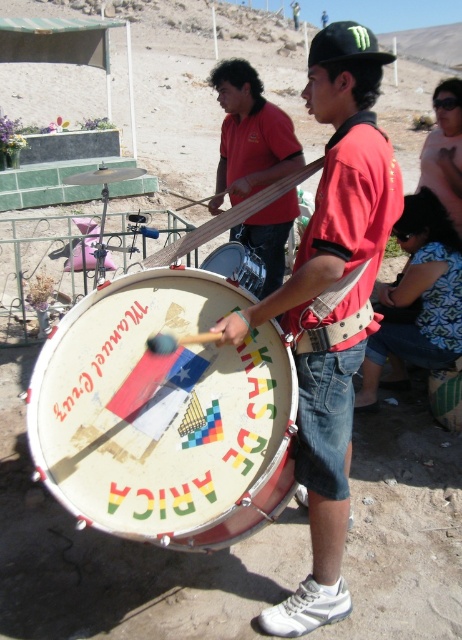
Question: Which object is the farthest from the blue denim shorts at lower right?

Choices:
 (A) black matte baseball cap at upper center
 (B) white painted drum at center
 (C) red matte shirt at center

Answer: (B)

Question: Is blue denim shorts at lower right smaller than matte pink sunglasses at upper right?

Choices:
 (A) no
 (B) yes

Answer: (A)

Question: In this image, where is red matte shirt at center located relative to blue denim shorts at lower right?

Choices:
 (A) above
 (B) below

Answer: (B)

Question: Which object is closer to the camera taking this photo?

Choices:
 (A) red matte shirt at center
 (B) black matte baseball cap at upper center

Answer: (A)

Question: Which point is closer to the camera?

Choices:
 (A) (351, 54)
 (B) (200, 266)

Answer: (A)

Question: Does matte pink sunglasses at upper right have a lesser width compared to black matte baseball cap at upper center?

Choices:
 (A) yes
 (B) no

Answer: (A)